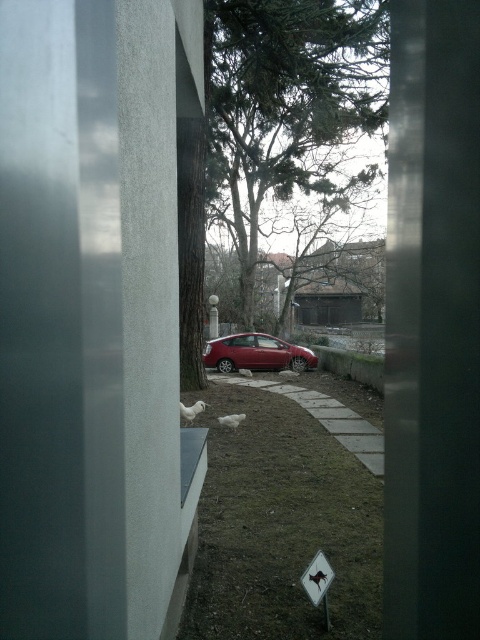
Question: Does green leafy tree at center have a lesser width compared to gray concrete curb at center?

Choices:
 (A) yes
 (B) no

Answer: (B)

Question: Which of the following is the farthest from the observer?

Choices:
 (A) metallic diamond-shaped sign at lower center
 (B) shiny red car at center
 (C) green grass at lower center
 (D) green leafy tree at center

Answer: (B)

Question: Is green leafy tree at center to the left of shiny red car at center from the viewer's perspective?

Choices:
 (A) yes
 (B) no

Answer: (B)

Question: Among these objects, which one is nearest to the camera?

Choices:
 (A) gray concrete curb at center
 (B) green leafy tree at center
 (C) shiny red car at center

Answer: (B)

Question: Based on their relative distances, which object is farther from the shiny red car at center?

Choices:
 (A) gray concrete curb at center
 (B) green grass at lower center
 (C) green leafy tree at center

Answer: (C)

Question: Where is gray concrete curb at center located in relation to metallic diamond-shaped sign at lower center in the image?

Choices:
 (A) below
 (B) above

Answer: (B)